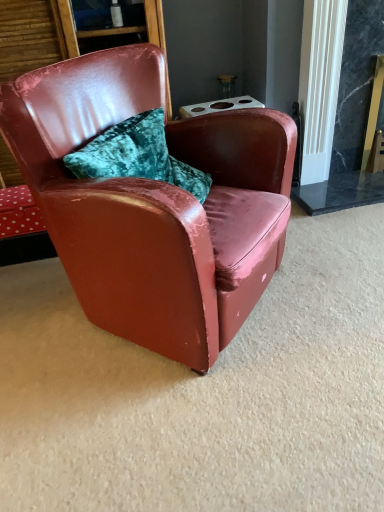
You are a GUI agent. You are given a task and a screenshot of the screen. Output one action in this format:
    pyautogui.click(x=<x>, y=<y>)
    Task: Click on the free location in front of glossy leather chair at center
    This screenshot has width=384, height=512.
    Given the screenshot: What is the action you would take?
    pyautogui.click(x=185, y=422)